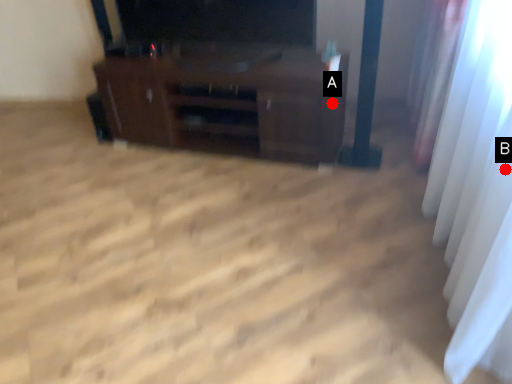
Question: Two points are circled on the image, labeled by A and B beside each circle. Which of the following is the farthest from the observer?

Choices:
 (A) A is further
 (B) B is further

Answer: (A)